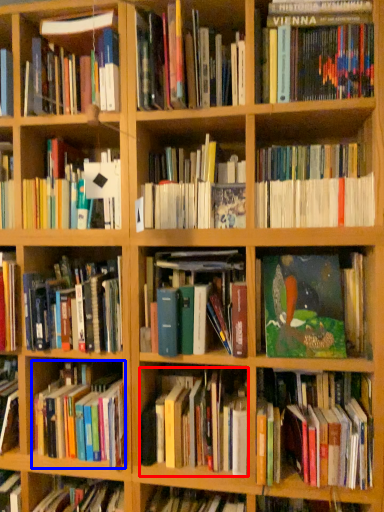
Question: Which of the following is the closest to the observer, book (highlighted by a red box) or book (highlighted by a blue box)?

Choices:
 (A) book
 (B) book

Answer: (A)